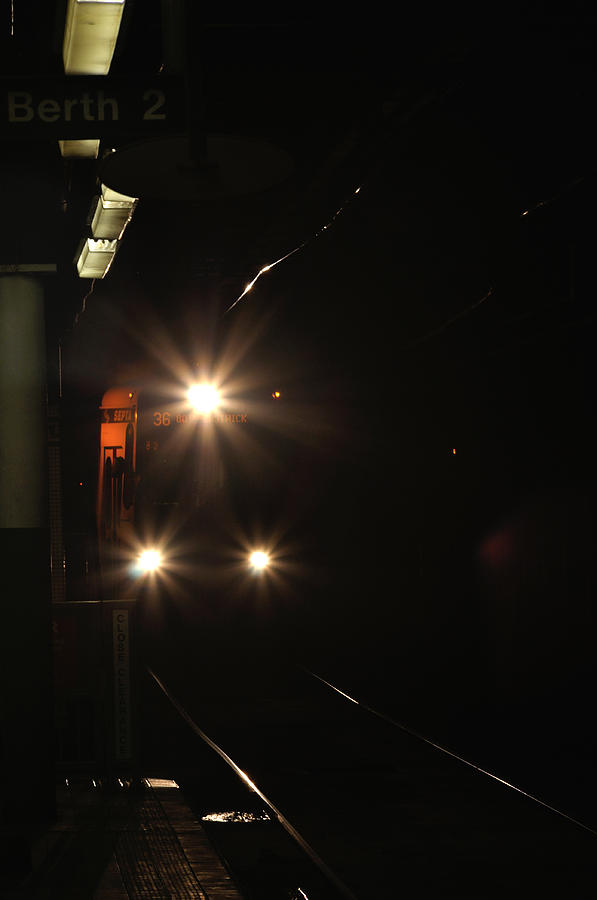
Find the location of a particular element. fish shaped light object is located at coordinates pyautogui.click(x=233, y=816).